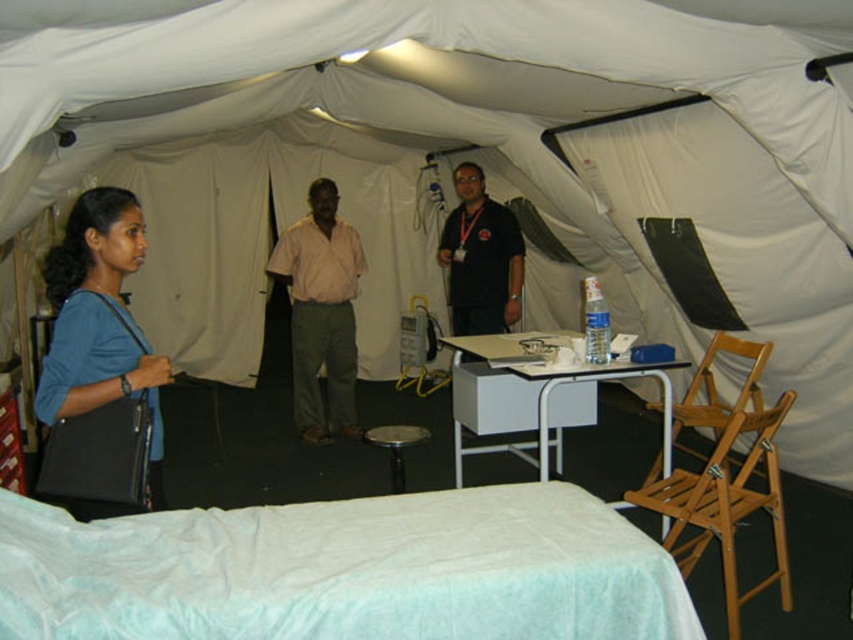
You are a healthcare worker preparing to place a medical kit on the table. The table has limited space. Given the sizes of the matte black bag at lower left and the metallic silver stool at center, which object takes up more horizontal space?

The matte black bag at lower left has a larger width than the metallic silver stool at center, so it occupies more horizontal space.

You are a healthcare worker entering the medical tent and need to place a new medical kit on the table. However, the table is currently occupied by the black smooth shirt at center and the metallic silver stool at center. Can you place the medical kit on the table without moving these items?

The black smooth shirt at center is positioned over metallic silver stool at center, so the metallic silver stool at center is already under the shirt. Since both items are on the table, there might not be enough space to place the medical kit without moving them.

You are a healthcare worker entering the medical tent and need to place a new medical kit on the table. The medical kit is 40 cm wide. Can you determine if the black smooth shirt at center will fit on the table next to the metallic silver stool at center?

The black smooth shirt at center might be wider than the metallic silver stool at center. Since the medical kit is 40 cm wide, but the exact width of the black smooth shirt at center is not provided, it is uncertain if there will be enough space. Please check the actual dimensions before placing the kit.